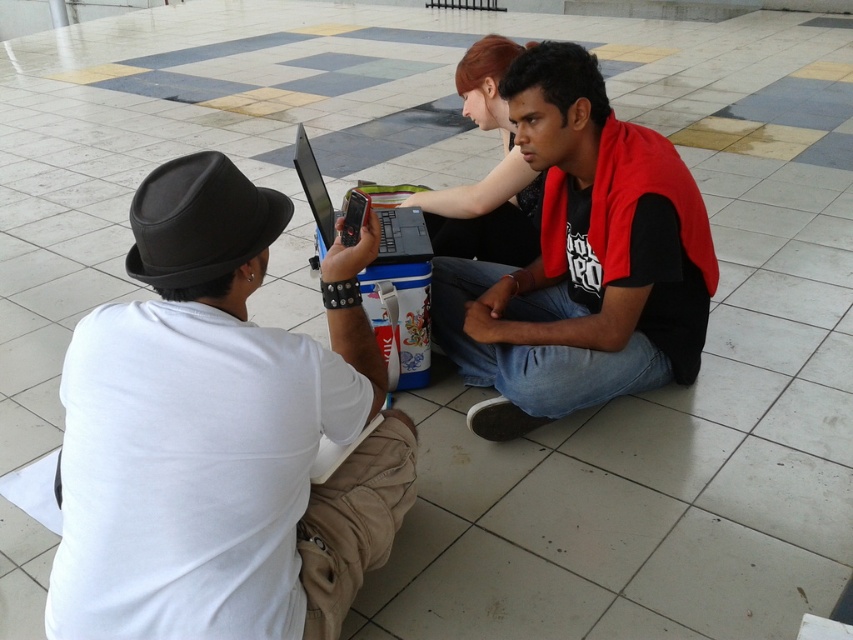
From the picture: Does black matte shirt at center have a greater height compared to silver metallic laptop at center?

Correct, black matte shirt at center is much taller as silver metallic laptop at center.

Is black matte shirt at center above silver metallic laptop at center?

Incorrect, black matte shirt at center is not positioned above silver metallic laptop at center.

Is point (656, 337) less distant than point (393, 211)?

Yes, point (656, 337) is in front of point (393, 211).

Find the location of a particular element. The image size is (853, 640). black matte shirt at center is located at coordinates (581, 260).

Does white matte shirt at left appear over black matte plug hat at left?

Actually, white matte shirt at left is below black matte plug hat at left.

This screenshot has height=640, width=853. In order to click on white matte shirt at left in this screenshot , I will do `click(219, 433)`.

The height and width of the screenshot is (640, 853). What are the coordinates of `white matte shirt at left` in the screenshot? It's located at (219, 433).

Is white matte shirt at left shorter than black matte shirt at center?

Correct, white matte shirt at left is not as tall as black matte shirt at center.

Is white matte shirt at left closer to camera compared to black matte shirt at center?

Yes.

Where is `white matte shirt at left`? The image size is (853, 640). white matte shirt at left is located at coordinates (219, 433).

Locate an element on the screen. white matte shirt at left is located at coordinates (219, 433).